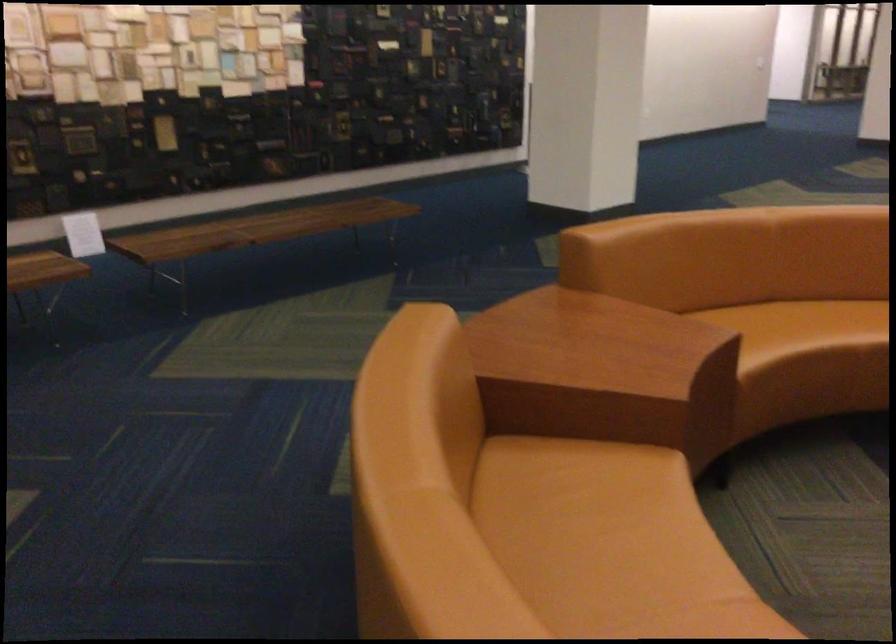
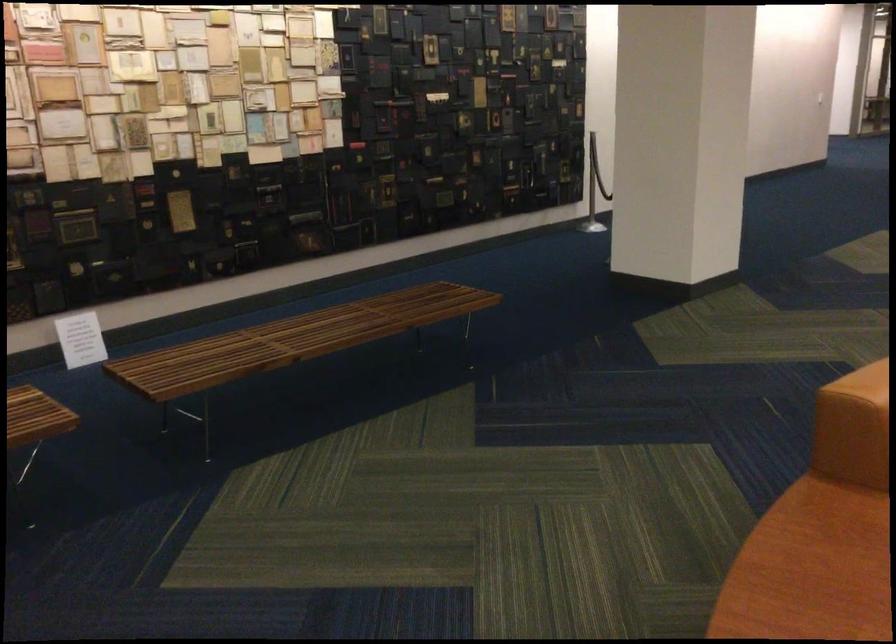
Locate, in the second image, the point that corresponds to (523,321) in the first image.

(808, 570)